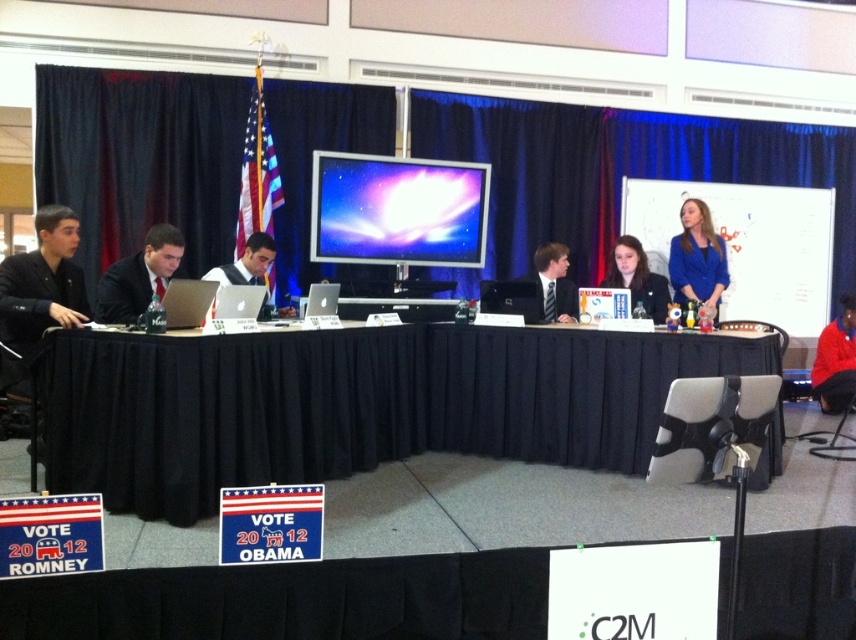
Question: Which point is closer to the camera?

Choices:
 (A) matte silver laptop at center
 (B) matte black tie at center
 (C) matte blue shirt at center
 (D) matte black suit at left

Answer: (D)

Question: Can you confirm if matte blue shirt at center is positioned to the right of matte silver laptop at center?

Choices:
 (A) no
 (B) yes

Answer: (B)

Question: Based on their relative distances, which object is nearer to the black fabric curtain at upper center?

Choices:
 (A) blue fabric jacket at upper right
 (B) matte black tie at center
 (C) red sweater at lower right

Answer: (C)

Question: Is whiteboard at upper right to the right of matte blue shirt at center from the viewer's perspective?

Choices:
 (A) yes
 (B) no

Answer: (A)

Question: Which object is closer to the camera taking this photo?

Choices:
 (A) matte plastic screen at center
 (B) matte blue shirt at center
 (C) matte silver laptop at center
 (D) black fabric table at center

Answer: (D)

Question: Where is black fabric table at center located in relation to whiteboard at upper right in the image?

Choices:
 (A) right
 (B) left

Answer: (B)